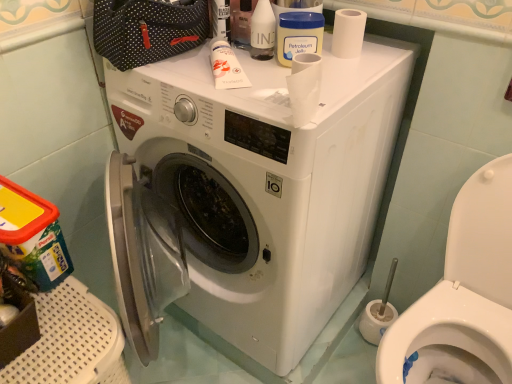
The height and width of the screenshot is (384, 512). Find the location of `free location to the right of white matte toilet paper at upper right`. free location to the right of white matte toilet paper at upper right is located at coordinates (387, 50).